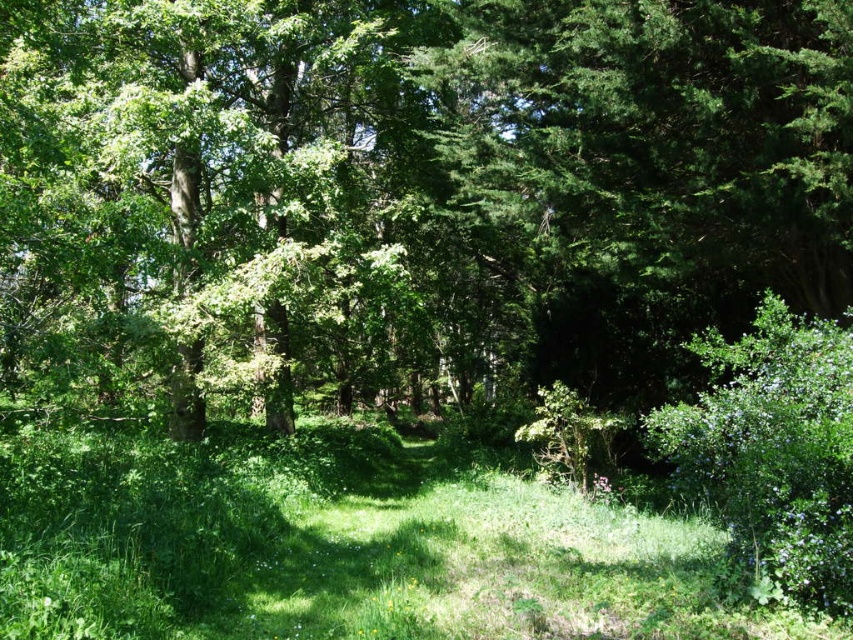
You are standing in the forest and want to take a photo of the green leafy tree at center. If your camera has a maximum focus range of 5 meters, will you need to move closer to capture it clearly?

The green leafy tree at center is 5.78 meters away from the viewer. Since the camera can only focus up to 5 meters, you need to move closer to ensure the tree is within the focus range.

You are standing in the forest and see a point marked at coordinates (421, 179). Based on the scene description, which object does this point belong to?

The point at (421, 179) is on the green leafy tree at center.

You are a hiker standing in the middle of the forest. You notice a green leafy tree at center and green grass at center. Which one is taller?

The green leafy tree at center is much taller than the green grass at center.